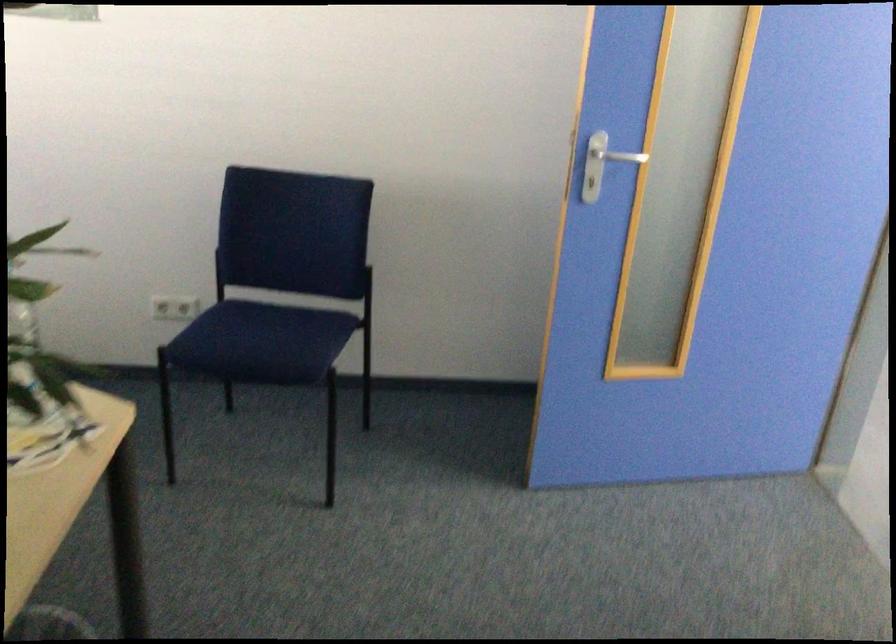
Where would you push the silver door handle? Please return your answer as a coordinate pair (x, y).

(619, 156)